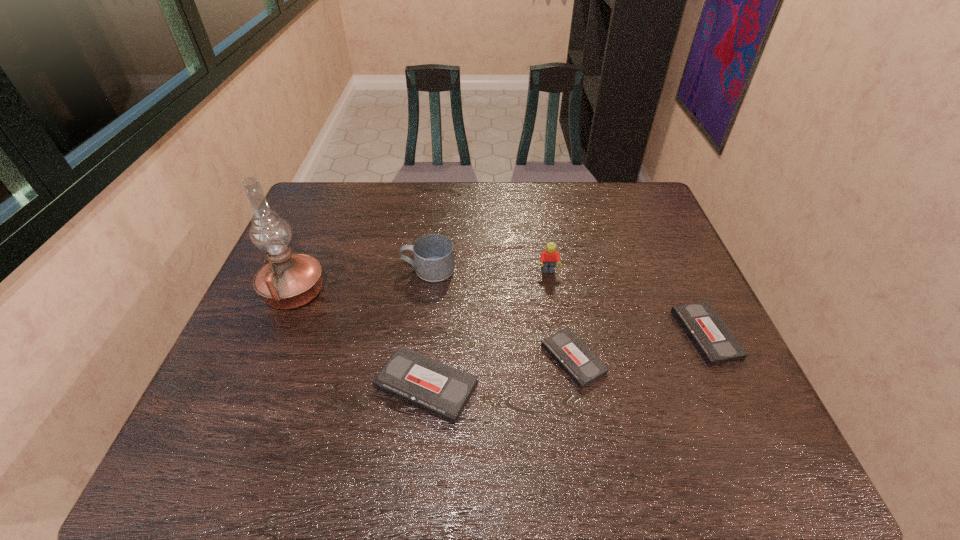
Image resolution: width=960 pixels, height=540 pixels. I want to click on the leftmost videotape, so click(443, 391).

You are a GUI agent. You are given a task and a screenshot of the screen. Output one action in this format:
    pyautogui.click(x=<x>, y=<y>)
    Task: Click on the shortest object
    The image size is (960, 540).
    Given the screenshot: What is the action you would take?
    pyautogui.click(x=572, y=355)

At what (x,y) coordinates should I click in order to perform the action: click on the second videotape from right to left. Please return your answer as a coordinate pair (x, y). Image resolution: width=960 pixels, height=540 pixels. Looking at the image, I should click on click(572, 355).

Locate an element on the screen. This screenshot has width=960, height=540. the second shortest videotape is located at coordinates (713, 340).

The height and width of the screenshot is (540, 960). I want to click on the rightmost object, so click(713, 340).

Where is `the tallest object`? This screenshot has width=960, height=540. the tallest object is located at coordinates (287, 281).

You are a GUI agent. You are given a task and a screenshot of the screen. Output one action in this format:
    pyautogui.click(x=<x>, y=<y>)
    Task: Click on the oil lamp
    Image resolution: width=960 pixels, height=540 pixels.
    Given the screenshot: What is the action you would take?
    pyautogui.click(x=287, y=281)

Where is `Lego`? Lego is located at coordinates (548, 258).

Where is `mug`? This screenshot has width=960, height=540. mug is located at coordinates (434, 257).

At what (x,y) coordinates should I click in order to perform the action: click on free spot located 0.100m on the back of the leftmost videotape. Please return your answer as a coordinate pair (x, y). The height and width of the screenshot is (540, 960). Looking at the image, I should click on (433, 320).